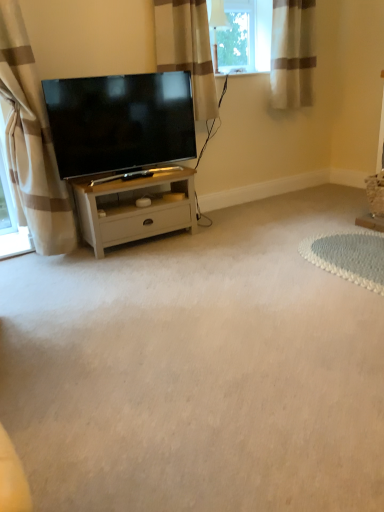
The width and height of the screenshot is (384, 512). I want to click on vacant region below beige striped curtain at left, the third curtain when ordered from right to left (from a real-world perspective), so click(x=26, y=262).